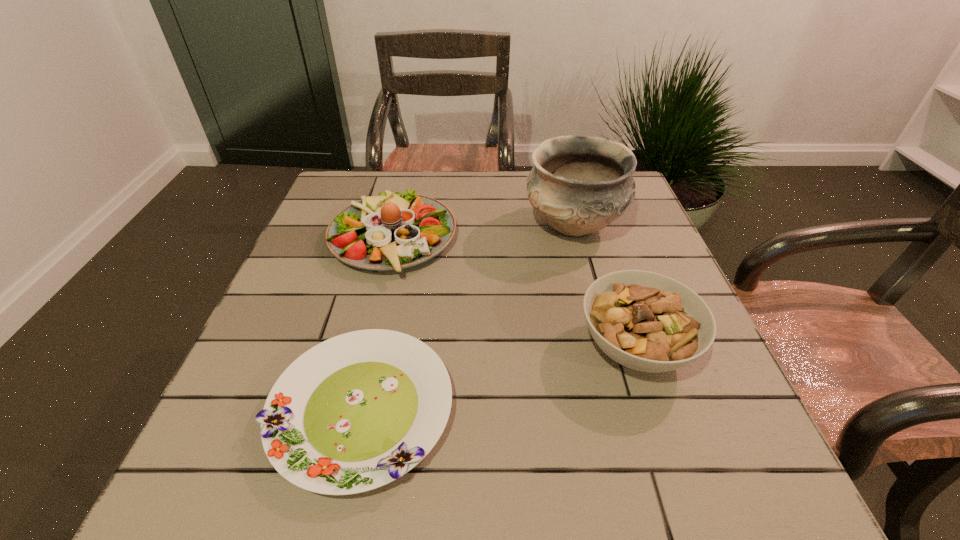
You are a GUI agent. You are given a task and a screenshot of the screen. Output one action in this format:
    pyautogui.click(x=<x>, y=<y>)
    Task: Click on the vacant space at the right edge of the desktop
    The width and height of the screenshot is (960, 540).
    Given the screenshot: What is the action you would take?
    pyautogui.click(x=637, y=381)

Where is `vacant area at the far left corner`? This screenshot has height=540, width=960. vacant area at the far left corner is located at coordinates (373, 177).

At what (x,y) coordinates should I click in order to perform the action: click on vacant region at the near right corner. Please return your answer as a coordinate pair (x, y). Looking at the image, I should click on (753, 499).

Where is `free spot between the stew and the nearer salad plate`? The image size is (960, 540). free spot between the stew and the nearer salad plate is located at coordinates (498, 379).

What are the coordinates of `free space between the shorter salad plate and the farther salad plate` in the screenshot? It's located at (377, 325).

Locate an element on the screen. Image resolution: width=960 pixels, height=540 pixels. unoccupied position between the pottery and the shortest object is located at coordinates (468, 318).

Where is `blank region between the nearer salad plate and the taller salad plate`? Image resolution: width=960 pixels, height=540 pixels. blank region between the nearer salad plate and the taller salad plate is located at coordinates (377, 325).

The height and width of the screenshot is (540, 960). In order to click on vacant region between the shorter salad plate and the stew in this screenshot , I will do `click(498, 379)`.

Where is `free space between the stew and the farther salad plate`? This screenshot has width=960, height=540. free space between the stew and the farther salad plate is located at coordinates (514, 293).

Identify the location of empty location between the pottery and the farther salad plate. The width and height of the screenshot is (960, 540). (483, 233).